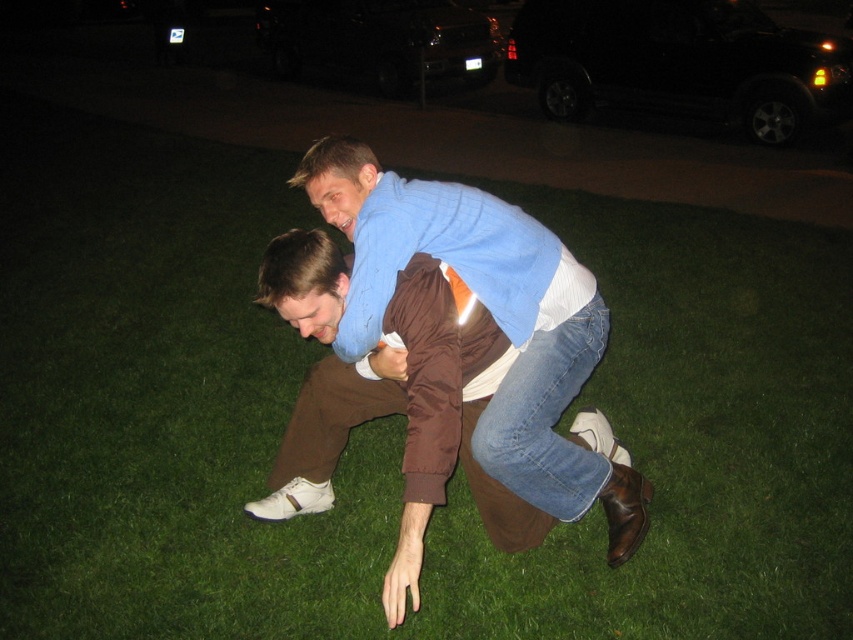
Which is above, blue cotton sweater at center or black matte suv at upper center?

black matte suv at upper center is above.

Between point (495, 209) and point (514, 36), which one is positioned in front?

Point (495, 209)

Is point (500, 285) positioned after point (616, 22)?

No, (500, 285) is in front of (616, 22).

The width and height of the screenshot is (853, 640). I want to click on blue cotton sweater at center, so click(492, 317).